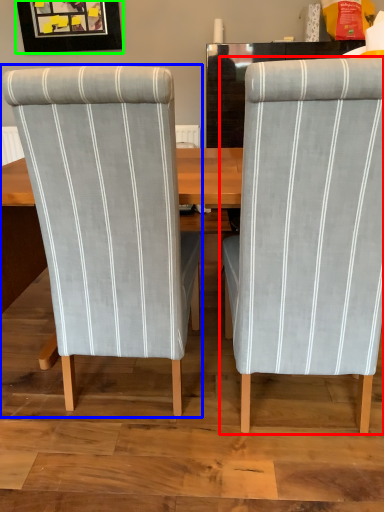
Question: Based on their relative distances, which object is nearer to chair (highlighted by a red box)? Choose from chair (highlighted by a blue box) and picture frame (highlighted by a green box).

Choices:
 (A) chair
 (B) picture frame

Answer: (A)